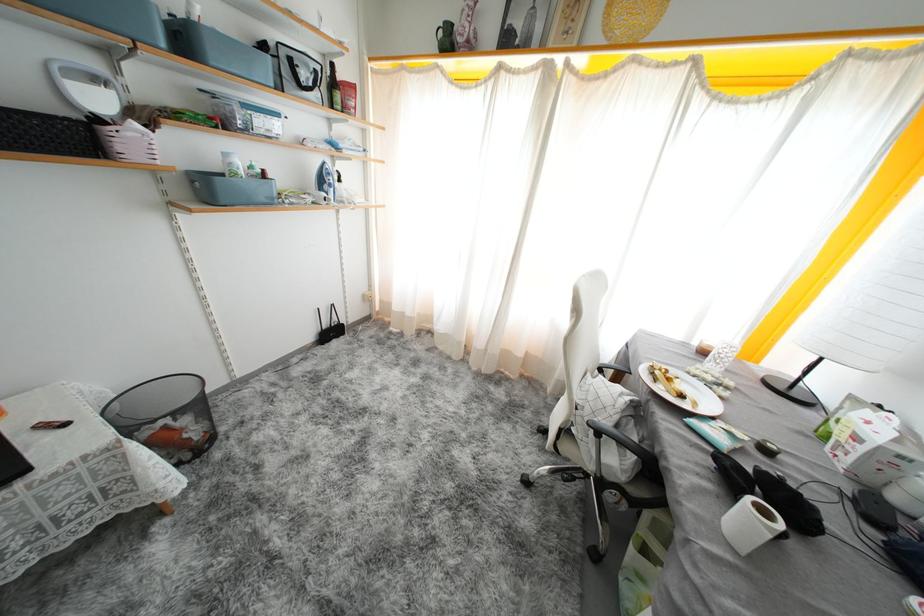
At what (x,y) coordinates should I click in order to perform the action: click on green jug handle. Please return your answer as a coordinate pair (x, y). Looking at the image, I should click on (444, 41).